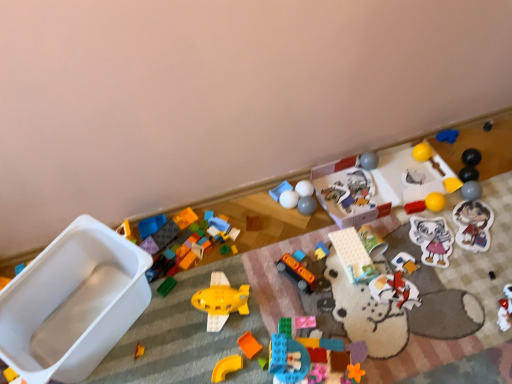
This screenshot has height=384, width=512. I want to click on vacant space that is in between white plastic container at left, which is the 1th toy in left-to-right order, and orange matte bus at center, the tenth toy when ordered from left to right, so click(192, 311).